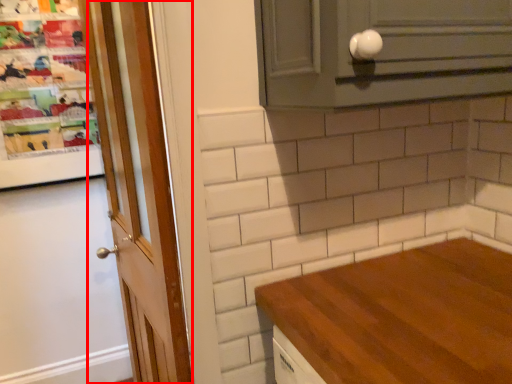
Question: From the image, what is the correct spatial relationship of door (annotated by the red box) in relation to cabinetry?

Choices:
 (A) right
 (B) left

Answer: (B)